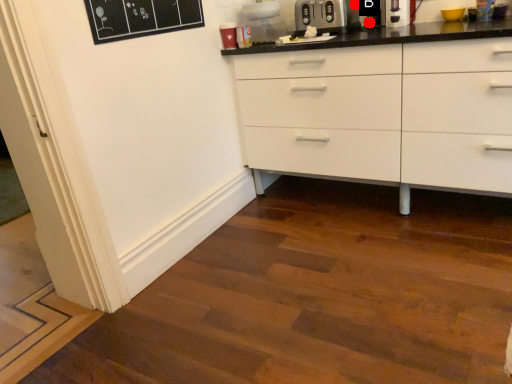
Question: Two points are circled on the image, labeled by A and B beside each circle. Among these points, which one is farthest from the camera?

Choices:
 (A) A is further
 (B) B is further

Answer: (A)